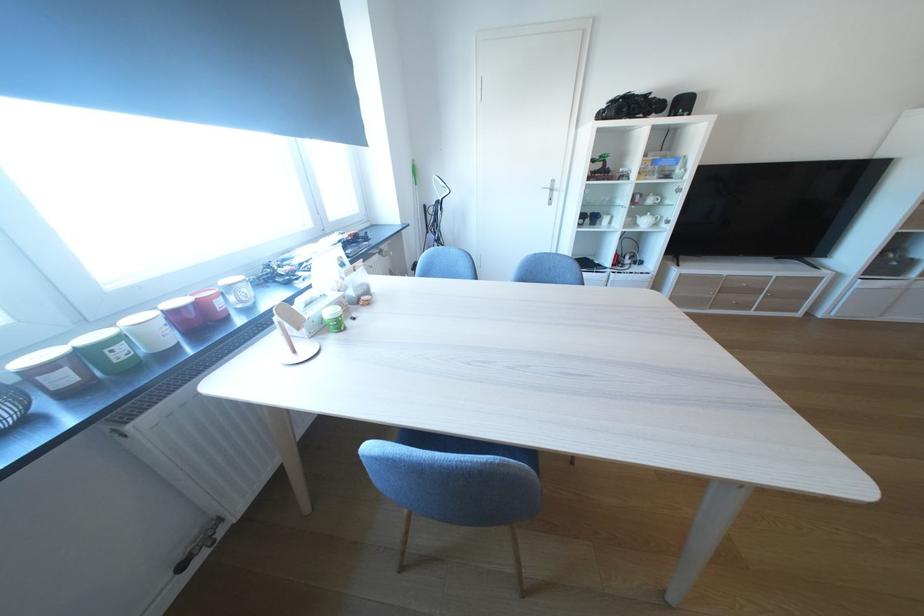
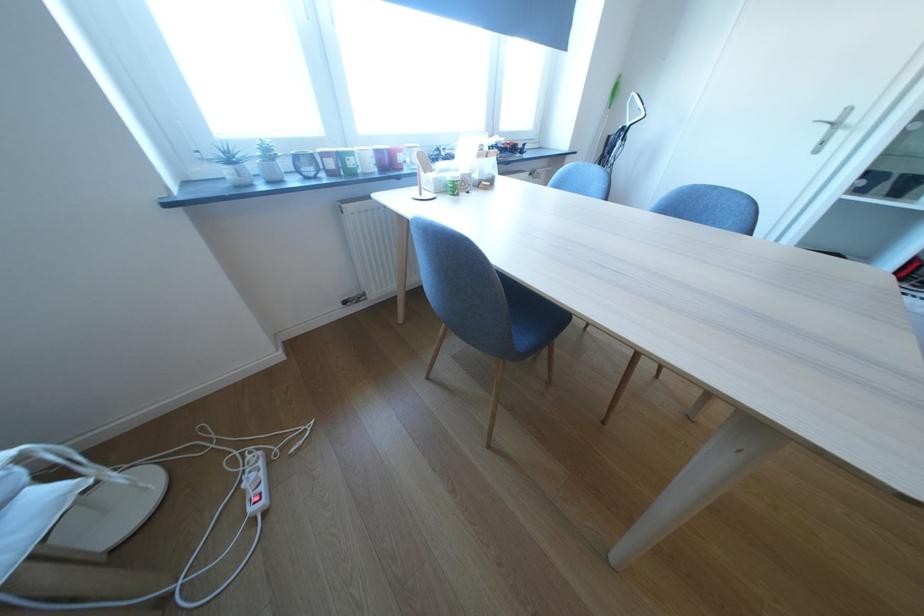
Find the pixel in the second image that matches (129,354) in the first image.

(361, 164)